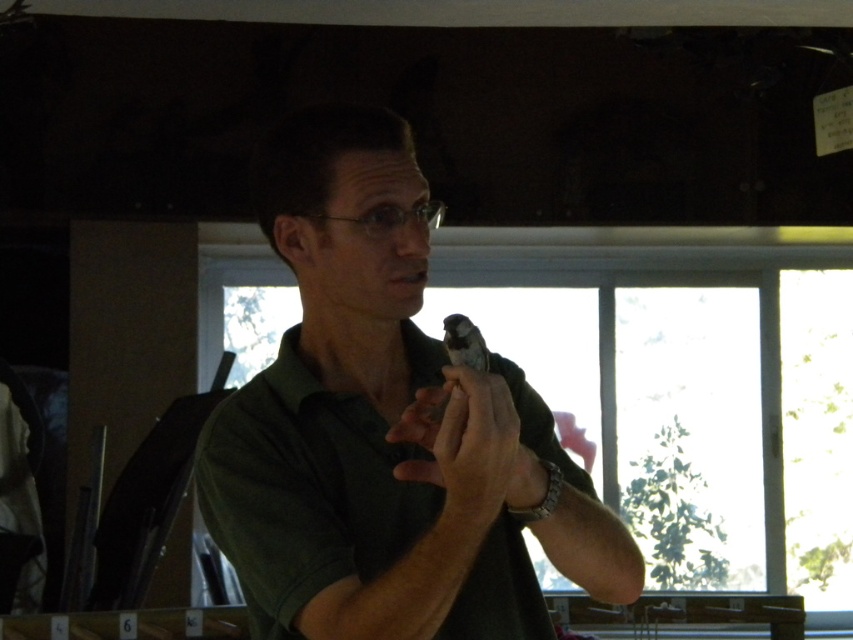
Question: Considering the relative positions of green matte shirt at center and matte black object at center in the image provided, where is green matte shirt at center located with respect to matte black object at center?

Choices:
 (A) above
 (B) below

Answer: (A)

Question: Is the position of green matte shirt at center more distant than that of matte black object at center?

Choices:
 (A) yes
 (B) no

Answer: (A)

Question: Among these points, which one is nearest to the camera?

Choices:
 (A) (279, 429)
 (B) (404, 426)

Answer: (B)

Question: Can you confirm if green matte shirt at center is thinner than matte black object at center?

Choices:
 (A) yes
 (B) no

Answer: (B)